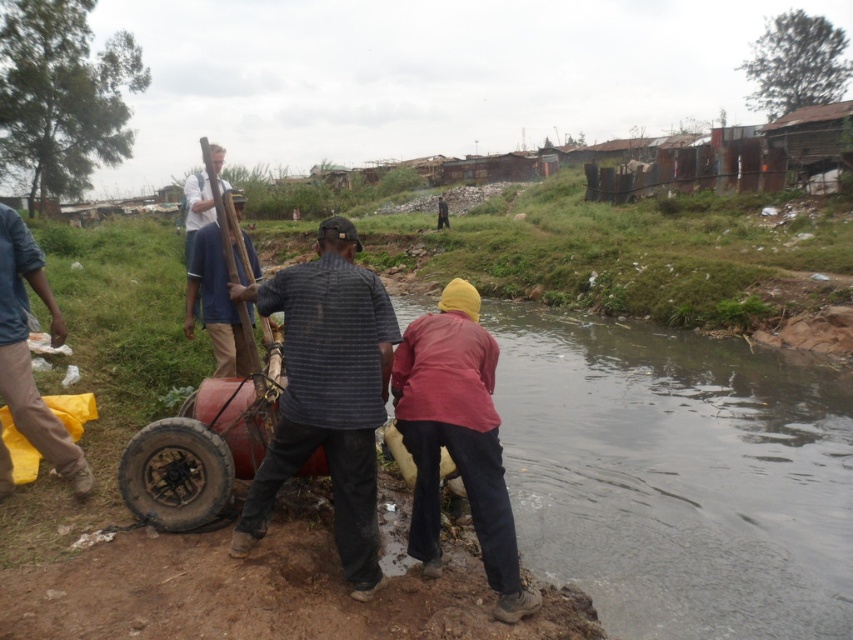
Question: Among these points, which one is nearest to the camera?

Choices:
 (A) (202, 212)
 (B) (201, 264)
 (C) (253, 289)
 (D) (184, 426)

Answer: (D)

Question: Does red matte shirt at lower center have a greater width compared to white matte shirt at upper center?

Choices:
 (A) yes
 (B) no

Answer: (B)

Question: Considering the real-world distances, which object is closest to the red matte shirt at lower center?

Choices:
 (A) blue fabric shirt at center
 (B) brown cotton shirt at left
 (C) dirty rubber tire at lower left
 (D) white matte shirt at upper center

Answer: (C)

Question: Does red matte shirt at lower center appear on the right side of dirty rubber tire at lower left?

Choices:
 (A) no
 (B) yes

Answer: (B)

Question: Does striped cotton shirt at center lie in front of red matte shirt at lower center?

Choices:
 (A) no
 (B) yes

Answer: (A)

Question: Among these points, which one is nearest to the camera?

Choices:
 (A) (196, 220)
 (B) (36, 268)

Answer: (B)